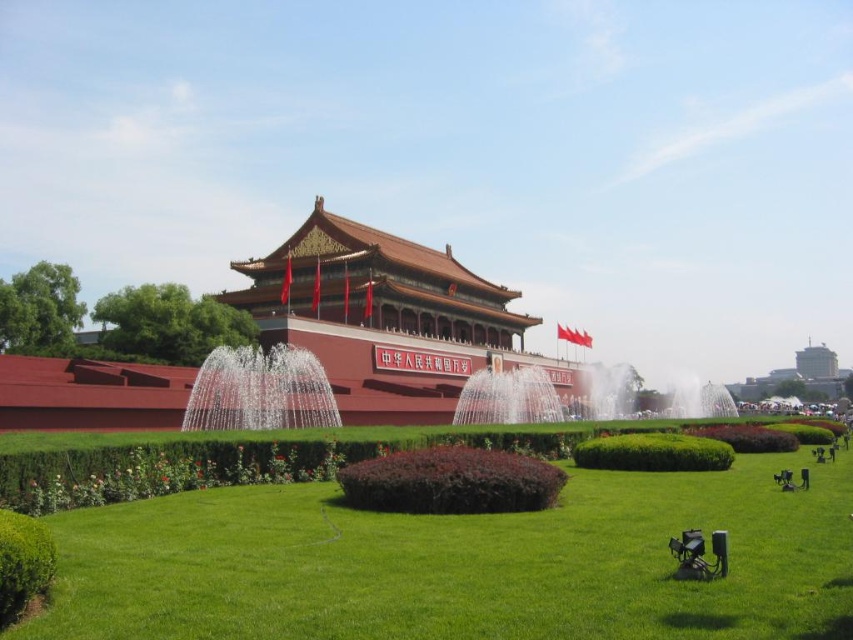
You are standing at the entrance of the traditional Chinese architectural structure with a red wall and golden roof. You want to walk directly to the green grass at center. Which direction should you head towards?

A: The green grass at center is located at point (462,563), so you should head towards the center area in front of the structure to reach it.

You are standing at the entrance of the traditional Chinese gate with a golden roof. You want to walk towards the green grass at center. Which direction should you walk to reach it?

You should walk towards the center of the scene, where the green grass at center is located at coordinates point (462, 563).